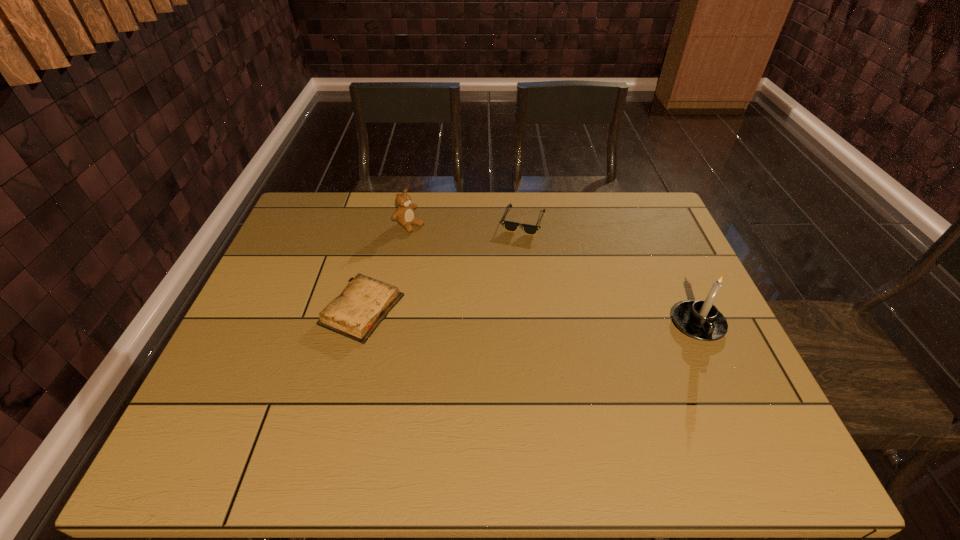
This screenshot has width=960, height=540. Find the location of `free space located on the front-facing side of the teddy bear`. free space located on the front-facing side of the teddy bear is located at coordinates point(502,284).

Find the location of a particular element. vacant space located 0.350m on the front-facing side of the teddy bear is located at coordinates (505, 286).

This screenshot has width=960, height=540. In order to click on free region located on the front-facing side of the teddy bear in this screenshot , I will do `click(491, 277)`.

Find the location of a particular element. sunglasses located in the far edge section of the desktop is located at coordinates (508, 225).

Locate an element on the screen. teddy bear present at the far edge is located at coordinates (404, 215).

Locate an element on the screen. object that is positioned at the right edge is located at coordinates (701, 320).

What are the coordinates of `vacant space at the far edge of the desktop` in the screenshot? It's located at (348, 234).

Where is `vacant area at the near edge`? The width and height of the screenshot is (960, 540). vacant area at the near edge is located at coordinates (471, 386).

At what (x,y) coordinates should I click in order to perform the action: click on vacant space at the left edge of the desktop. Please return your answer as a coordinate pair (x, y). Looking at the image, I should click on (321, 275).

This screenshot has width=960, height=540. In order to click on free location at the far left corner in this screenshot , I will do `click(324, 193)`.